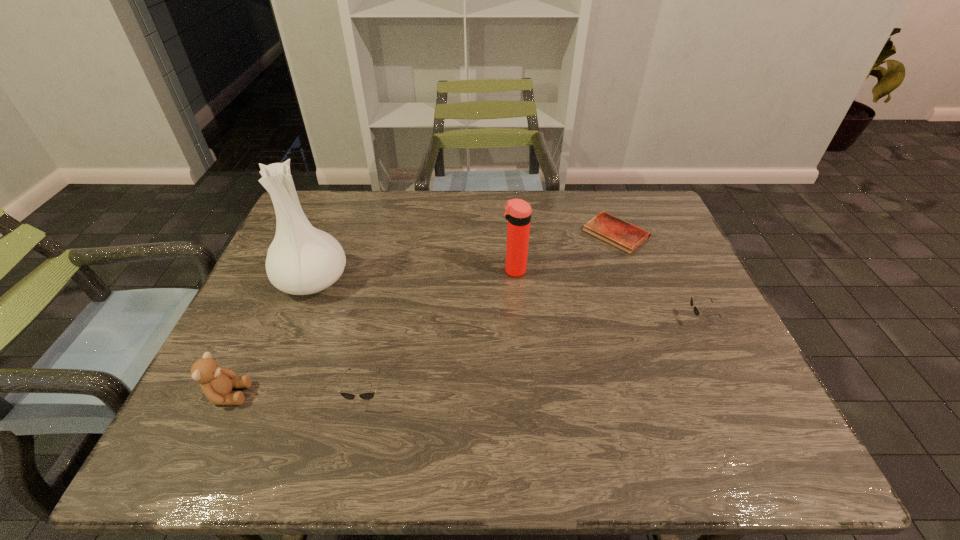
The height and width of the screenshot is (540, 960). Find the location of `free point at the near right corner`. free point at the near right corner is located at coordinates (741, 381).

Locate an element on the screen. The width and height of the screenshot is (960, 540). vacant space that's between the thermos bottle and the left sunglasses is located at coordinates (440, 334).

Locate an element on the screen. Image resolution: width=960 pixels, height=540 pixels. empty space between the teddy bear and the shortest object is located at coordinates (422, 314).

Locate an element on the screen. free point between the teddy bear and the diary is located at coordinates (422, 314).

Locate an element on the screen. This screenshot has width=960, height=540. unoccupied position between the tallest object and the shortest object is located at coordinates (x=465, y=257).

Where is `free space between the taller sunglasses and the vase`? free space between the taller sunglasses and the vase is located at coordinates (x=339, y=339).

The image size is (960, 540). Find the location of `free space between the diary and the left sunglasses`. free space between the diary and the left sunglasses is located at coordinates (491, 315).

The width and height of the screenshot is (960, 540). I want to click on blank region between the thermos bottle and the shorter sunglasses, so click(607, 295).

Where is `unoccupied position between the fourth object from left to right and the vase`? Image resolution: width=960 pixels, height=540 pixels. unoccupied position between the fourth object from left to right and the vase is located at coordinates (414, 275).

Identify the location of vacant area that lies between the shorter sunglasses and the thermos bottle. [607, 295].